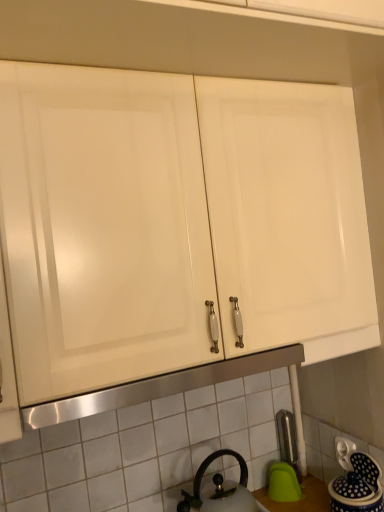
Question: From the image's perspective, is black matte kettle at lower center on blue glazed ceramic jar at lower right?

Choices:
 (A) no
 (B) yes

Answer: (B)

Question: From a real-world perspective, is black matte kettle at lower center beneath blue glazed ceramic jar at lower right?

Choices:
 (A) yes
 (B) no

Answer: (B)

Question: Can you confirm if black matte kettle at lower center is wider than blue glazed ceramic jar at lower right?

Choices:
 (A) no
 (B) yes

Answer: (B)

Question: From a real-world perspective, is black matte kettle at lower center over blue glazed ceramic jar at lower right?

Choices:
 (A) yes
 (B) no

Answer: (A)

Question: Considering the relative sizes of black matte kettle at lower center and blue glazed ceramic jar at lower right in the image provided, is black matte kettle at lower center bigger than blue glazed ceramic jar at lower right?

Choices:
 (A) no
 (B) yes

Answer: (B)

Question: Can you confirm if black matte kettle at lower center is shorter than blue glazed ceramic jar at lower right?

Choices:
 (A) yes
 (B) no

Answer: (B)

Question: Is black matte kettle at lower center not within satin nickel faucet at lower right?

Choices:
 (A) no
 (B) yes

Answer: (B)

Question: From a real-world perspective, is black matte kettle at lower center physically below satin nickel faucet at lower right?

Choices:
 (A) yes
 (B) no

Answer: (B)

Question: Is there a large distance between black matte kettle at lower center and satin nickel faucet at lower right?

Choices:
 (A) no
 (B) yes

Answer: (A)

Question: Considering the relative sizes of black matte kettle at lower center and satin nickel faucet at lower right in the image provided, is black matte kettle at lower center smaller than satin nickel faucet at lower right?

Choices:
 (A) yes
 (B) no

Answer: (B)

Question: Is black matte kettle at lower center shorter than satin nickel faucet at lower right?

Choices:
 (A) no
 (B) yes

Answer: (B)

Question: From a real-world perspective, is black matte kettle at lower center located higher than satin nickel faucet at lower right?

Choices:
 (A) no
 (B) yes

Answer: (B)

Question: Does blue glazed ceramic jar at lower right appear on the right side of black matte kettle at lower center?

Choices:
 (A) no
 (B) yes

Answer: (B)